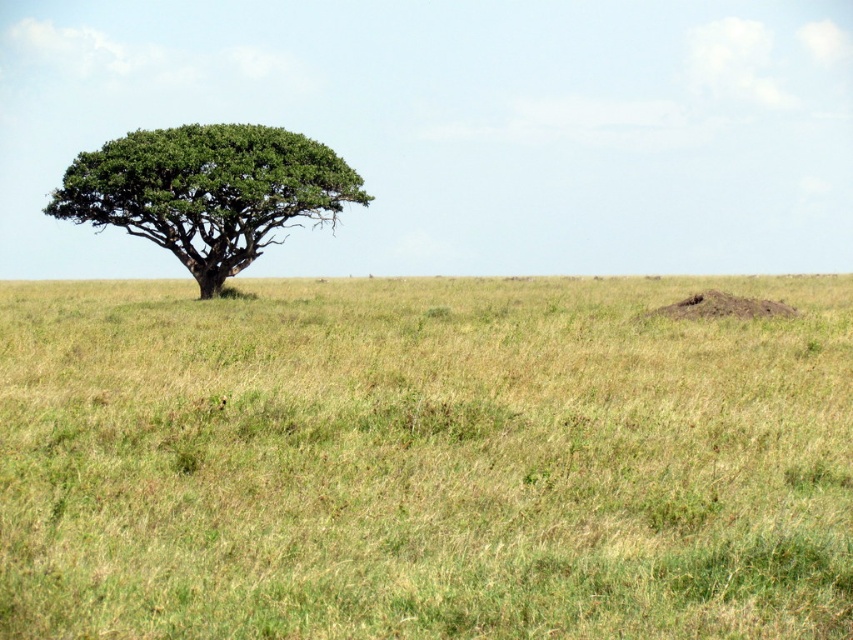
You are a park ranger planning to plant a new tree in the savanna. The current solitary tree is on the left side of the image, and there is green grass at center. According to the coordinates provided, where should you place the new tree to ensure it is not too close to the existing tree and the grass?

The green grass at center is located at coordinates point (422,460). To avoid placing the new tree too close to the existing solitary tree on the left and the grass at center, the park ranger should choose a location that is sufficiently distant from both, ensuring proper spacing for growth.

You are a safari guide standing at the base of the solitary tree with a wide, rounded canopy on the left side of the savanna. You notice two points marked on the ground ahead of you. One is labeled as point (456,632) and the other as point (274,186). Which point is closer to you?

Point (456,632) is in front of point (274,186), so it is closer to you.

Based on the photo, you are a giraffe standing at the center of the savanna. You want to reach the leaves of the green leafy tree at left to eat. Considering the height of the green grass at center and the tree, can you easily reach the leaves?

The green grass at center is not as tall as the green leafy tree at left, so the tree is taller. Giraffes can easily reach the leaves of the green leafy tree at left since they are tall enough to browse from taller vegetation.